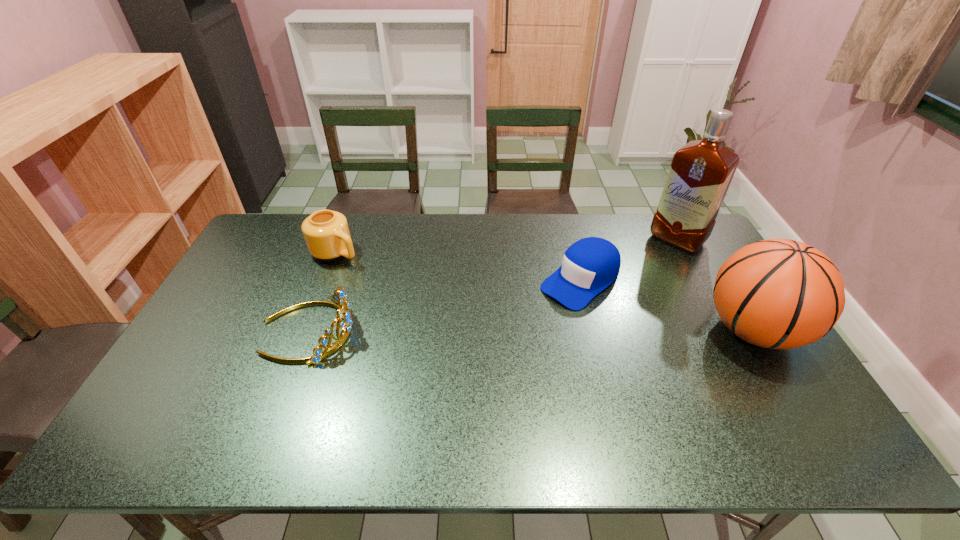
You are a GUI agent. You are given a task and a screenshot of the screen. Output one action in this format:
    pyautogui.click(x=<x>, y=<y>)
    Task: Click on the liquor located at the right edge
    
    Given the screenshot: What is the action you would take?
    [x=700, y=174]

This screenshot has width=960, height=540. Identify the location of object present at the far right corner. (700, 174).

Image resolution: width=960 pixels, height=540 pixels. In order to click on free region at the far edge in this screenshot , I will do `click(377, 224)`.

This screenshot has height=540, width=960. In the image, there is a desktop. What are the coordinates of `vacant space at the near edge` in the screenshot? It's located at (252, 388).

In the image, there is a desktop. Where is `free region at the left edge`? The height and width of the screenshot is (540, 960). free region at the left edge is located at coordinates (238, 296).

In the image, there is a desktop. Identify the location of free space at the right edge. (713, 338).

Find the location of a particular element. This screenshot has width=960, height=540. vacant area at the far left corner of the desktop is located at coordinates (308, 215).

Find the location of a particular element. The width and height of the screenshot is (960, 540). vacant space at the near right corner of the desktop is located at coordinates (746, 389).

The width and height of the screenshot is (960, 540). I want to click on free area in between the basketball and the tiara, so click(531, 330).

You are a GUI agent. You are given a task and a screenshot of the screen. Output one action in this format:
    pyautogui.click(x=<x>, y=<y>)
    Task: Click on the blank region between the shortest object and the second tallest object
    This screenshot has width=960, height=540.
    Given the screenshot: What is the action you would take?
    pyautogui.click(x=667, y=306)